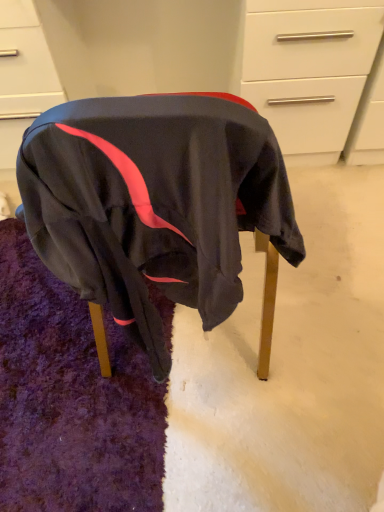
Locate an element on the screen. black fabric chair at center is located at coordinates (154, 203).

What do you see at coordinates (154, 203) in the screenshot? This screenshot has width=384, height=512. I see `black fabric chair at center` at bounding box center [154, 203].

The width and height of the screenshot is (384, 512). What are the coordinates of `black fabric chair at center` in the screenshot? It's located at (154, 203).